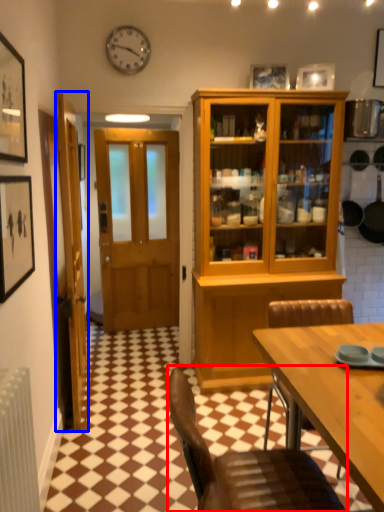
Question: Which object appears closest to the camera in this image, chair (highlighted by a red box) or door (highlighted by a blue box)?

Choices:
 (A) chair
 (B) door

Answer: (A)